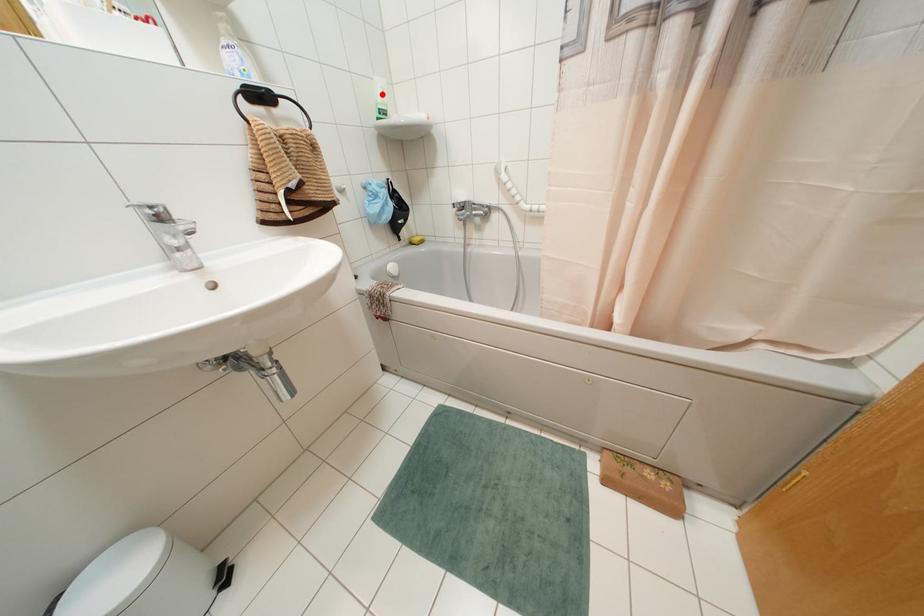
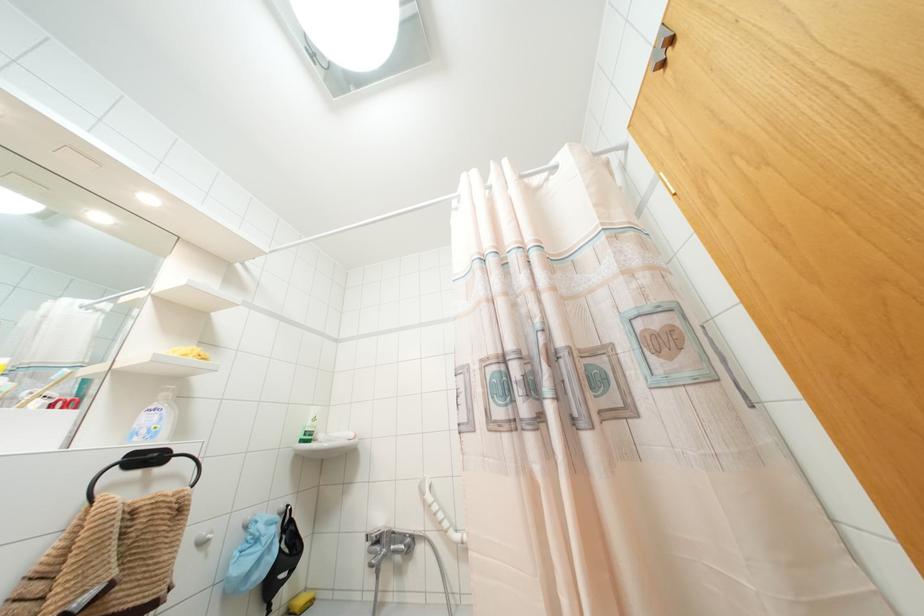
Find the pixel in the second image that matches the highlighted location in the first image.

(312, 419)